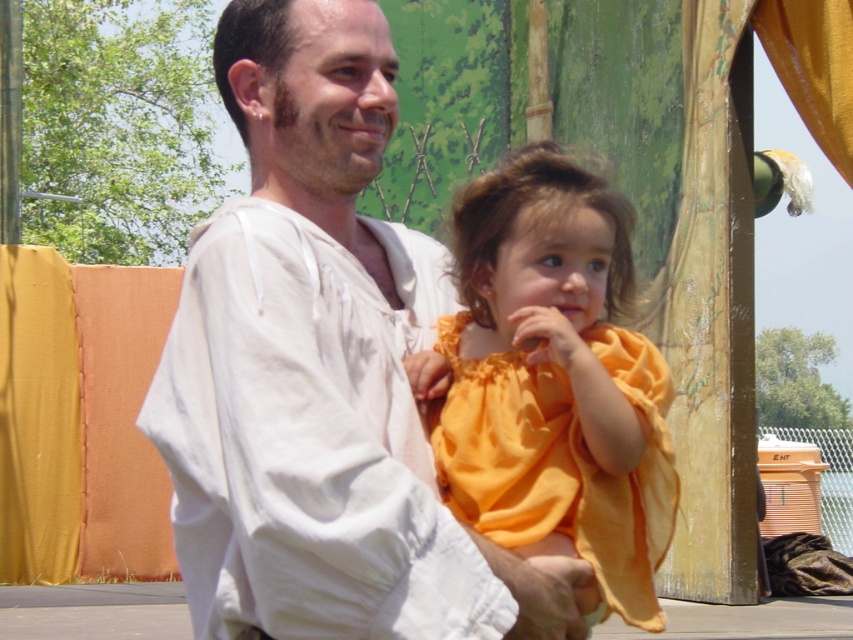
Which is more to the right, white cotton shirt at center or matte orange dress at center?

matte orange dress at center is more to the right.

Does white cotton shirt at center lie behind matte orange dress at center?

No, white cotton shirt at center is in front of matte orange dress at center.

Describe the element at coordinates (318, 371) in the screenshot. I see `white cotton shirt at center` at that location.

Image resolution: width=853 pixels, height=640 pixels. What are the coordinates of `white cotton shirt at center` in the screenshot? It's located at (318, 371).